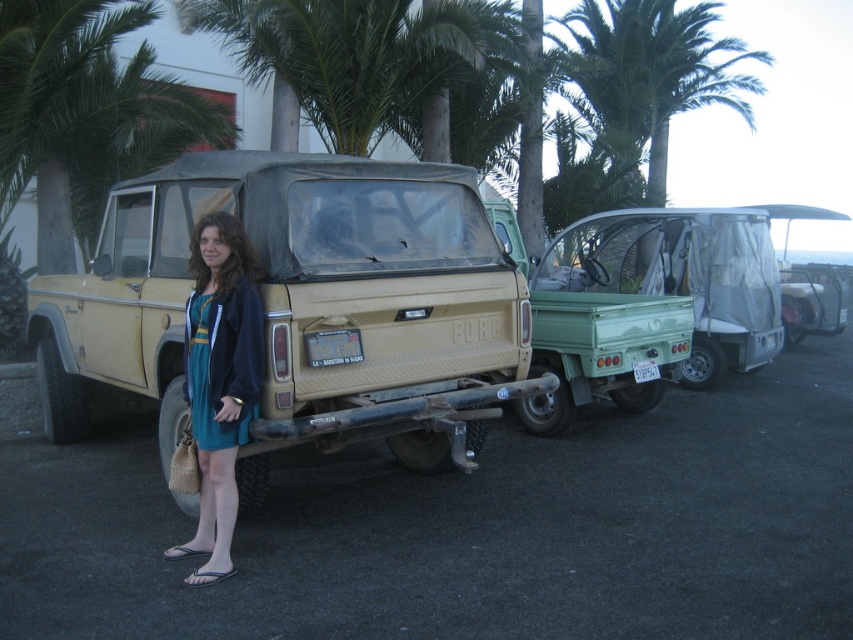
Between teal fabric dress at center and teal satin dress at lower left, which one is positioned higher?

teal satin dress at lower left is above.

Does teal fabric dress at center have a lesser width compared to teal satin dress at lower left?

No, teal fabric dress at center is not thinner than teal satin dress at lower left.

Is point (260, 300) closer to camera compared to point (238, 292)?

No, it is behind (238, 292).

The image size is (853, 640). I want to click on teal fabric dress at center, so click(219, 380).

Who is positioned more to the right, green matte pickup truck at right or green leafy palm tree at upper center?

green leafy palm tree at upper center

In the scene shown: Can you confirm if green matte pickup truck at right is smaller than green leafy palm tree at upper center?

Correct, green matte pickup truck at right occupies less space than green leafy palm tree at upper center.

Is point (656, 380) positioned before point (676, 64)?

That is True.

Where is `green matte pickup truck at right`? green matte pickup truck at right is located at coordinates (590, 321).

Which is in front, point (532, 308) or point (218, 445)?

Positioned in front is point (218, 445).

Does green matte pickup truck at right have a greater width compared to teal satin dress at lower left?

No, green matte pickup truck at right is not wider than teal satin dress at lower left.

The height and width of the screenshot is (640, 853). Identify the location of green matte pickup truck at right. click(x=590, y=321).